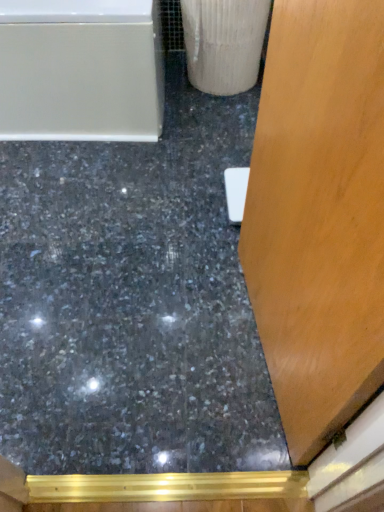
Question: Can you confirm if shiny black concrete at center is bigger than white glossy bathtub at upper left?

Choices:
 (A) no
 (B) yes

Answer: (A)

Question: Does shiny black concrete at center have a lesser width compared to white glossy bathtub at upper left?

Choices:
 (A) no
 (B) yes

Answer: (A)

Question: Can you confirm if shiny black concrete at center is positioned to the left of white glossy bathtub at upper left?

Choices:
 (A) yes
 (B) no

Answer: (B)

Question: Is shiny black concrete at center wider than white glossy bathtub at upper left?

Choices:
 (A) no
 (B) yes

Answer: (B)

Question: From the image's perspective, does shiny black concrete at center appear higher than white glossy bathtub at upper left?

Choices:
 (A) yes
 (B) no

Answer: (B)

Question: From a real-world perspective, is shiny black concrete at center on white glossy bathtub at upper left?

Choices:
 (A) yes
 (B) no

Answer: (B)

Question: Can you confirm if white glossy bathtub at upper left is positioned to the right of shiny black concrete at center?

Choices:
 (A) no
 (B) yes

Answer: (A)

Question: Is white glossy bathtub at upper left thinner than shiny black concrete at center?

Choices:
 (A) no
 (B) yes

Answer: (B)

Question: From the image's perspective, is white glossy bathtub at upper left on top of shiny black concrete at center?

Choices:
 (A) no
 (B) yes

Answer: (B)

Question: Is white glossy bathtub at upper left not inside shiny black concrete at center?

Choices:
 (A) yes
 (B) no

Answer: (A)

Question: From a real-world perspective, is white glossy bathtub at upper left over shiny black concrete at center?

Choices:
 (A) no
 (B) yes

Answer: (B)

Question: Is white glossy bathtub at upper left closer to the viewer compared to shiny black concrete at center?

Choices:
 (A) no
 (B) yes

Answer: (A)

Question: Is white glossy bathtub at upper left wider or thinner than shiny black concrete at center?

Choices:
 (A) wide
 (B) thin

Answer: (B)